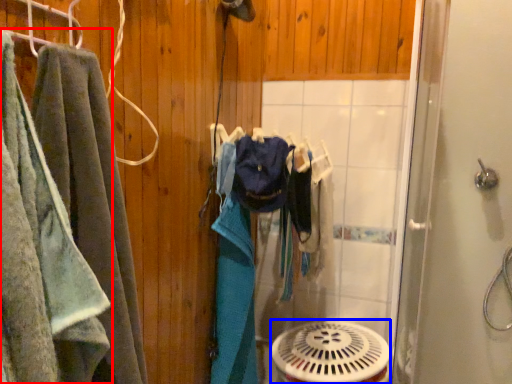
Question: Which of the following is the farthest to the observer, towel (highlighted by a red box) or mechanical fan (highlighted by a blue box)?

Choices:
 (A) towel
 (B) mechanical fan

Answer: (B)